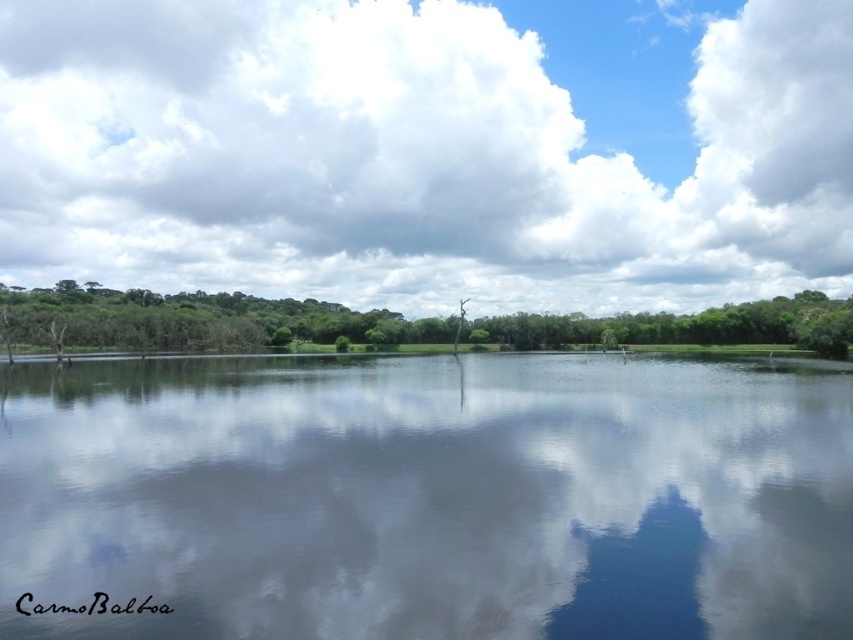
Question: Which object is the closest to the smooth reflective water at center?

Choices:
 (A) cloudy sky at upper center
 (B) green leafy tree at center

Answer: (B)

Question: Which is farther from the cloudy sky at upper center?

Choices:
 (A) smooth reflective water at center
 (B) green leafy tree at center

Answer: (A)

Question: Considering the relative positions of smooth reflective water at center and green leafy tree at center in the image provided, where is smooth reflective water at center located with respect to green leafy tree at center?

Choices:
 (A) left
 (B) right

Answer: (B)

Question: Which of the following is the farthest from the observer?

Choices:
 (A) (184, 292)
 (B) (720, 420)
 (C) (807, 45)

Answer: (C)

Question: Is smooth reflective water at center further to camera compared to cloudy sky at upper center?

Choices:
 (A) no
 (B) yes

Answer: (A)

Question: From the image, what is the correct spatial relationship of smooth reflective water at center in relation to green leafy tree at center?

Choices:
 (A) below
 (B) above

Answer: (A)